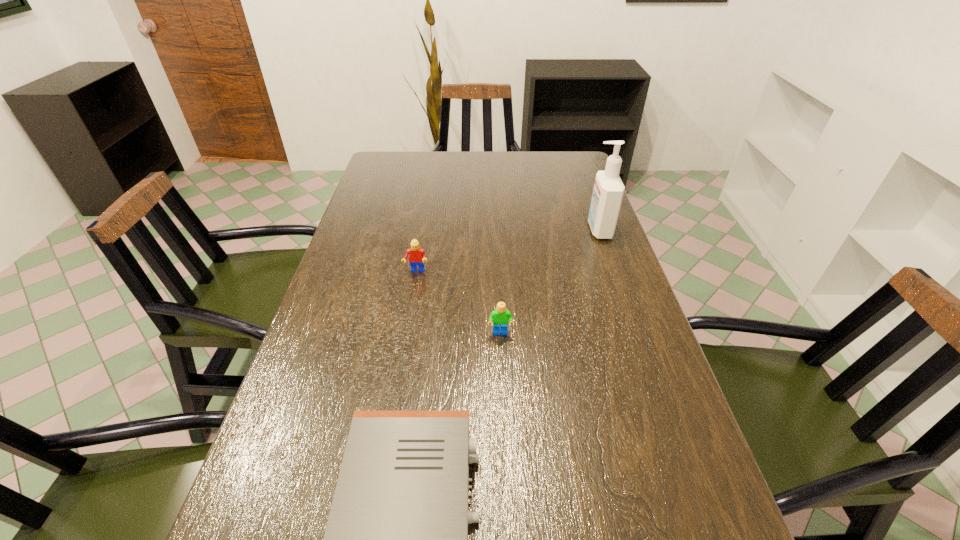
Select which object is the second closest to the cleansing agent. Please provide its 2D coordinates. Your answer should be formatted as a tuple, i.e. [(x, y)], where the tuple contains the x and y coordinates of a point satisfying the conditions above.

[(416, 255)]

I want to click on the third closest object to the radio receiver, so click(x=608, y=191).